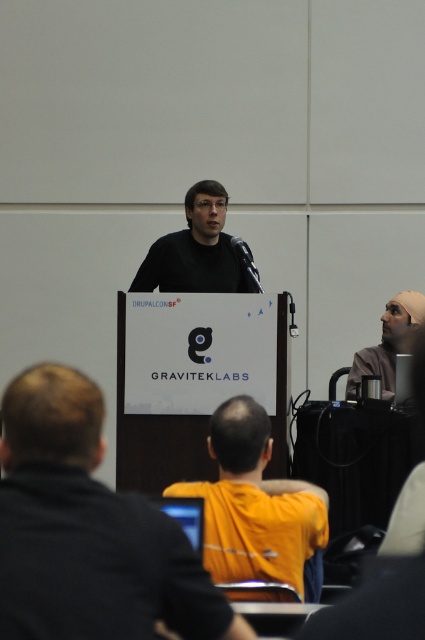
You are an attendee at the conference and you want to find the speaker who is wearing both the yellow fabric shirt at lower center and the matte black beanie at upper right. Which clothing item should you look for first to identify the speaker?

The yellow fabric shirt at lower center is bigger than the matte black beanie at upper right, so you should look for the yellow fabric shirt at lower center first as it is more noticeable due to its larger size.

You are a photographer setting up for a group photo. You need to ensure that both the yellow fabric shirt at lower center and the matte black beanie at upper right are in focus. Given that your camera has a depth of field that can cover objects within a 1.5 meter range, will both subjects be in focus?

The yellow fabric shirt at lower center and the matte black beanie at upper right are 1.86 meters apart from each other. Since the distance between them exceeds the camera depth of field range of 1.5 meters, both subjects may not be in focus simultaneously.

You are an event organizer who needs to ensure all speakers have shirts of equal width for a cohesive look. You notice the yellow fabric shirt at center and the matte black shirt at center. Which shirt should you adjust to match the other in terms of width?

The yellow fabric shirt at center has a smaller width than the matte black shirt at center. To achieve equal widths, the yellow fabric shirt at center should be adjusted to be wider to match the matte black shirt at center.